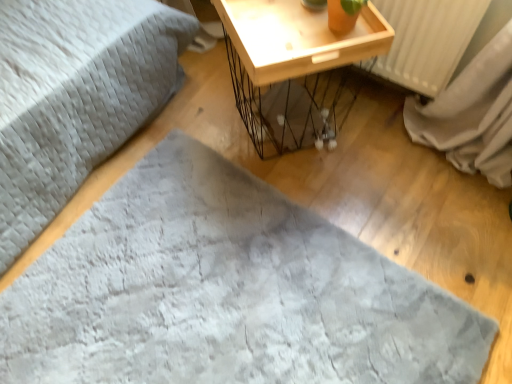
What are the coordinates of `empty space that is to the right of wooden tray at upper right` in the screenshot? It's located at (386, 149).